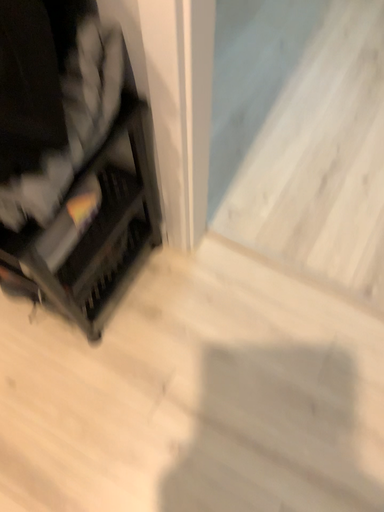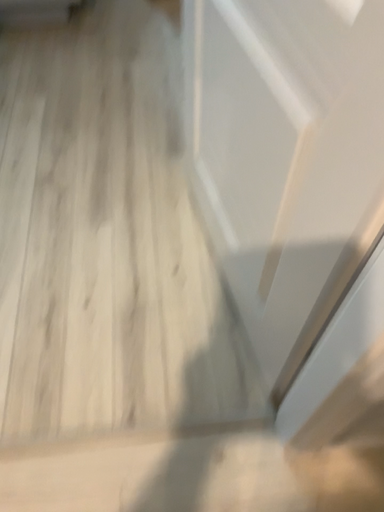
Question: How did the camera likely rotate when shooting the video?

Choices:
 (A) rotated upward
 (B) rotated downward

Answer: (A)